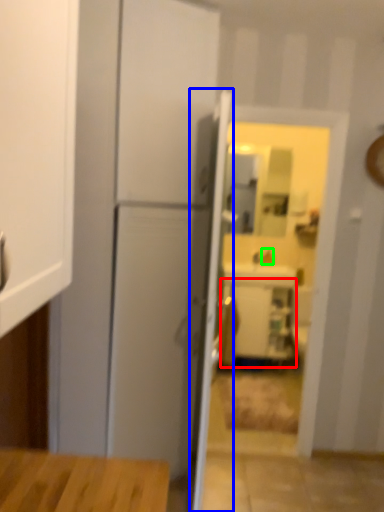
Question: Considering the real-world distances, which object is farthest from cabinetry (highlighted by a red box)? door (highlighted by a blue box) or faucet (highlighted by a green box)?

Choices:
 (A) door
 (B) faucet

Answer: (A)